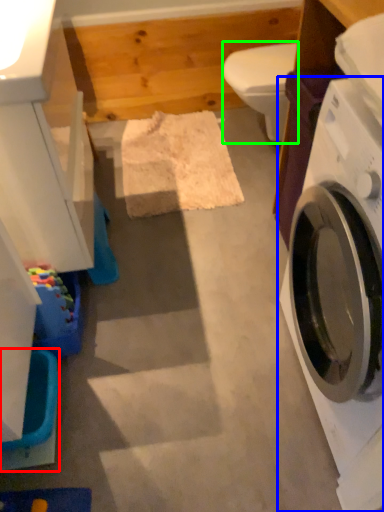
Question: Which object is positioned farthest from washer (highlighted by a red box)? Select from washing machine (highlighted by a blue box) and toilet bowl (highlighted by a green box).

Choices:
 (A) washing machine
 (B) toilet bowl

Answer: (B)